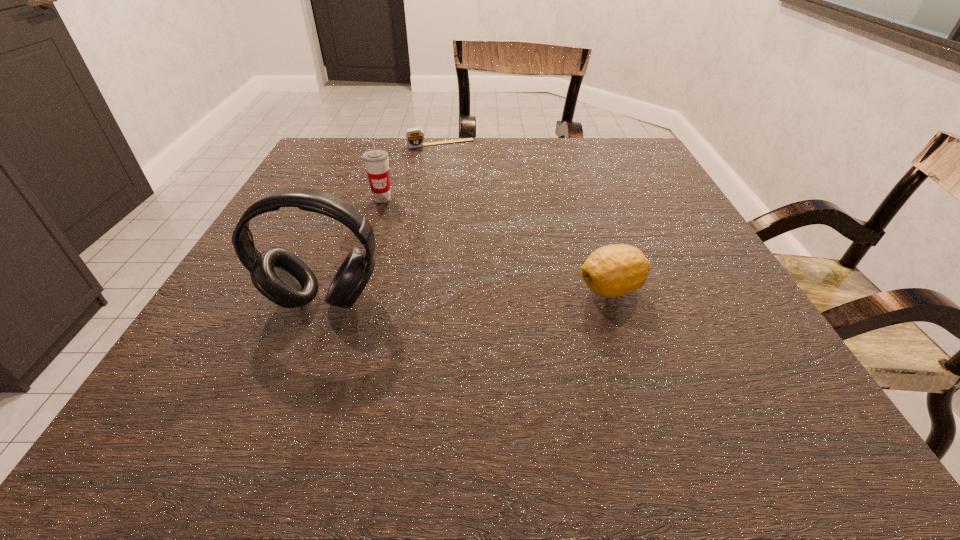
This screenshot has height=540, width=960. I want to click on vacant space that is in between the third shortest object and the lemon, so click(497, 244).

You are a GUI agent. You are given a task and a screenshot of the screen. Output one action in this format:
    pyautogui.click(x=<x>, y=<y>)
    Task: Click on the blank region between the tallest object and the rightmost object
    Image resolution: width=960 pixels, height=540 pixels.
    Given the screenshot: What is the action you would take?
    pyautogui.click(x=468, y=295)

The width and height of the screenshot is (960, 540). I want to click on free area in between the shortest object and the tallest object, so click(x=382, y=222).

At what (x,y) coordinates should I click in order to perform the action: click on empty space that is in between the tape measure and the lemon. Please return your answer as a coordinate pair (x, y). Looking at the image, I should click on (526, 217).

Locate an element on the screen. Image resolution: width=960 pixels, height=540 pixels. blank region between the cup and the third tallest object is located at coordinates (497, 244).

Select which object appears as the third closest to the third nearest object. Please provide its 2D coordinates. Your answer should be formatted as a tuple, i.e. [(x, y)], where the tuple contains the x and y coordinates of a point satisfying the conditions above.

[(614, 270)]

At what (x,y) coordinates should I click in order to perform the action: click on the third closest object to the tallest object. Please return your answer as a coordinate pair (x, y). Looking at the image, I should click on (414, 137).

Locate an element on the screen. This screenshot has height=540, width=960. vacant space that satisfies the following two spatial constraints: 1. on the front side of the second shortest object; 2. at the stem end of the cup is located at coordinates (353, 289).

I want to click on free location that satisfies the following two spatial constraints: 1. on the front side of the rightmost object; 2. at the stem end of the cup, so click(x=353, y=289).